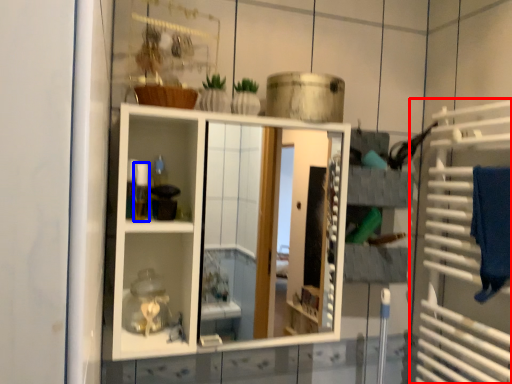
Question: Which point is further to the camera, cage (highlighted by a red box) or toiletry (highlighted by a blue box)?

Choices:
 (A) cage
 (B) toiletry

Answer: (B)